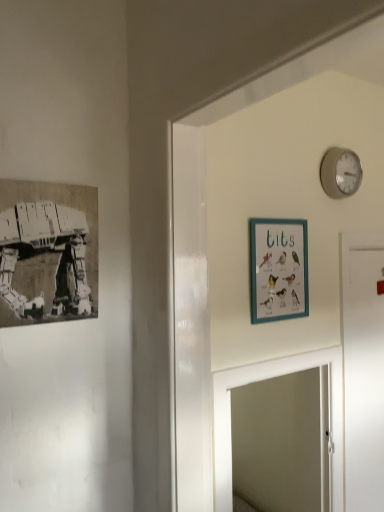
Question: From a real-world perspective, is black paper print at left, which is counted as the 1th picture frame, starting from the front, physically located above or below white matte door at right?

Choices:
 (A) above
 (B) below

Answer: (A)

Question: Is point (8, 223) positioned closer to the camera than point (382, 282)?

Choices:
 (A) farther
 (B) closer

Answer: (B)

Question: Which object is positioned closest to the white matte door at right?

Choices:
 (A) black paper print at left, acting as the 1th picture frame starting from the left
 (B) white glossy mirror at center
 (C) teal wooden picture frame at upper center, acting as the 1th picture frame starting from the back
 (D) white matte wall clock at upper right

Answer: (B)

Question: Which object is the farthest from the white glossy mirror at center?

Choices:
 (A) teal wooden picture frame at upper center, marked as the first picture frame in a right-to-left arrangement
 (B) white matte wall clock at upper right
 (C) white matte door at right
 (D) black paper print at left, which is counted as the 1th picture frame, starting from the front

Answer: (B)